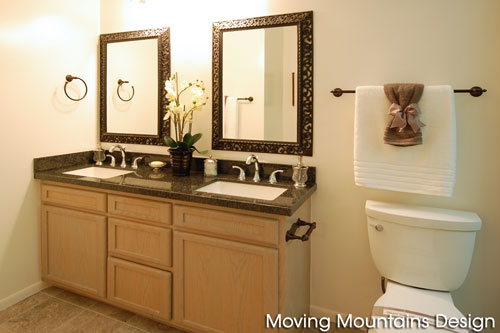
Locate an element on the screen. This screenshot has height=333, width=500. counter top is located at coordinates (186, 184).